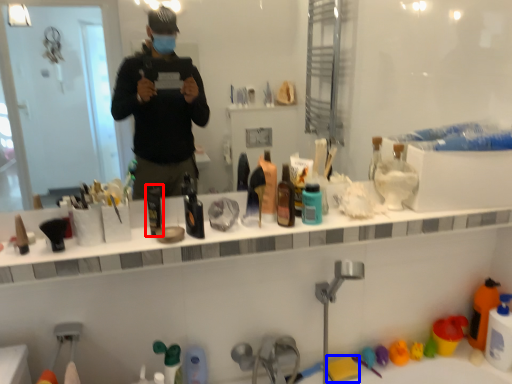
Question: Among these objects, which one is nearest to the camera, mouthwash (highlighted by a red box) or toy (highlighted by a blue box)?

Choices:
 (A) mouthwash
 (B) toy

Answer: (A)